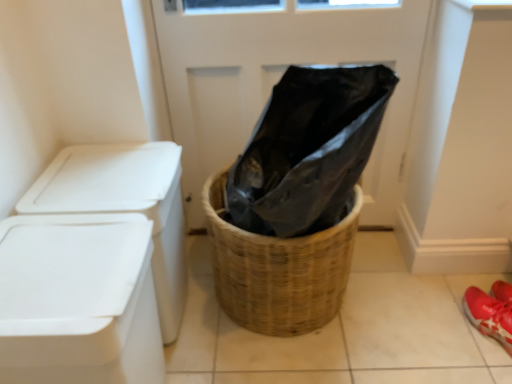
Locate an element on the screen. The width and height of the screenshot is (512, 384). free spot above white plastic container at left (from a real-world perspective) is located at coordinates (109, 173).